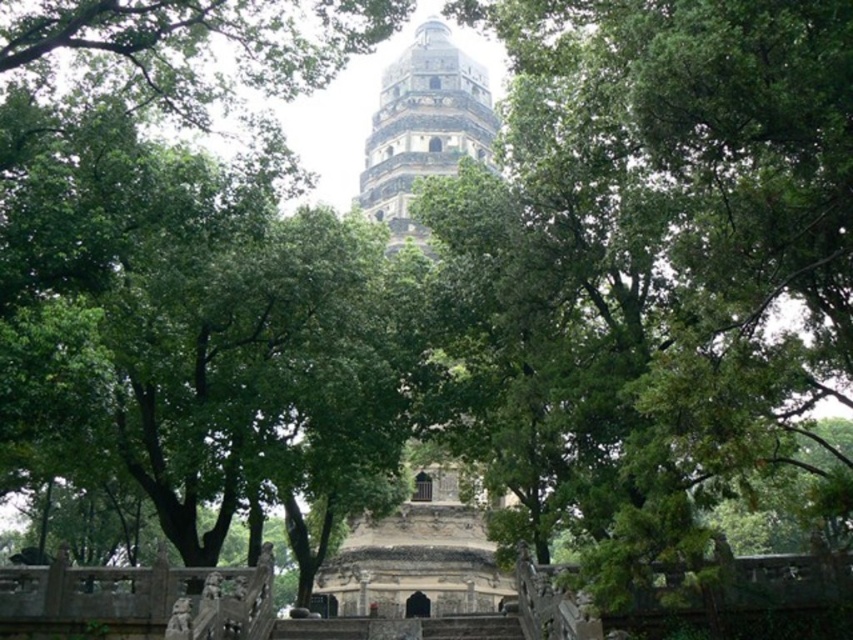
Question: Is stone tower at center bigger than gray stone tower at center?

Choices:
 (A) no
 (B) yes

Answer: (B)

Question: Which of the following is the closest to the observer?

Choices:
 (A) gray stone tower at center
 (B) dark gray stone stairs at center

Answer: (B)

Question: Among these points, which one is farthest from the camera?

Choices:
 (A) (468, 636)
 (B) (496, 116)
 (C) (361, 208)

Answer: (B)

Question: Is gray stone tower at center positioned at the back of dark gray stone stairs at center?

Choices:
 (A) no
 (B) yes

Answer: (B)

Question: Can you confirm if stone tower at center is wider than gray stone tower at center?

Choices:
 (A) yes
 (B) no

Answer: (B)

Question: Which object appears closest to the camera in this image?

Choices:
 (A) dark gray stone stairs at center
 (B) gray stone tower at center
 (C) stone tower at center

Answer: (A)